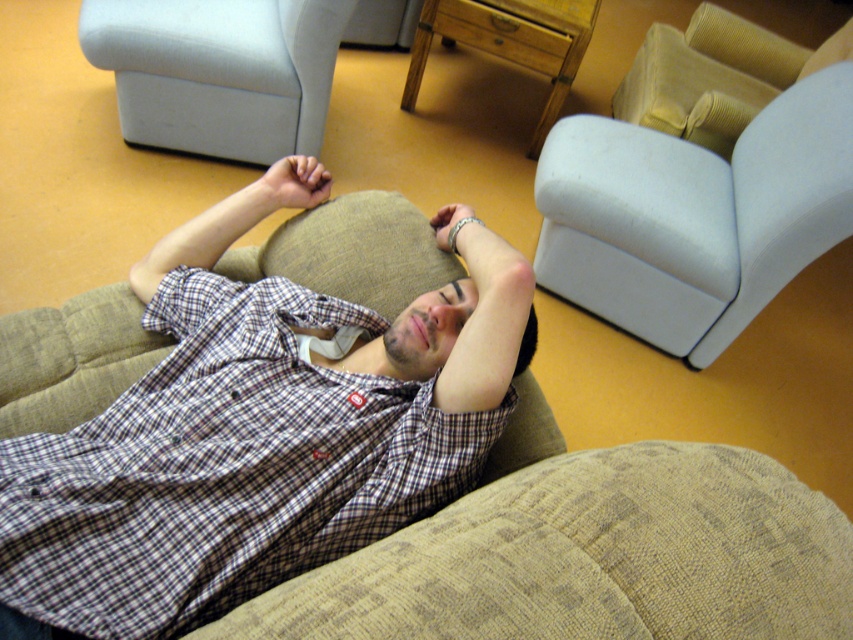
Question: Observing the image, what is the correct spatial positioning of white fabric armchair at upper right in reference to textured beige armchair at upper right?

Choices:
 (A) above
 (B) below

Answer: (B)

Question: Is white fabric armchair at upper right thinner than light gray fabric armchair at upper left?

Choices:
 (A) yes
 (B) no

Answer: (B)

Question: Does checkered fabric shirt at center have a greater width compared to white fabric armchair at upper right?

Choices:
 (A) yes
 (B) no

Answer: (B)

Question: Based on their relative distances, which object is farther from the checkered fabric shirt at center?

Choices:
 (A) textured beige armchair at upper right
 (B) light gray fabric armchair at upper left
 (C) white fabric armchair at upper right

Answer: (A)

Question: Considering the real-world distances, which object is closest to the light gray fabric armchair at upper left?

Choices:
 (A) textured beige armchair at upper right
 (B) white fabric armchair at upper right

Answer: (B)

Question: Which of the following is the farthest from the observer?

Choices:
 (A) (764, 45)
 (B) (160, 394)

Answer: (A)